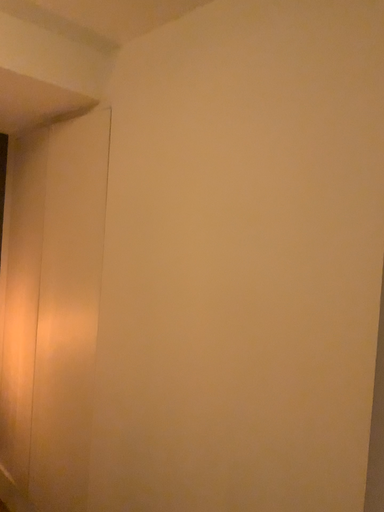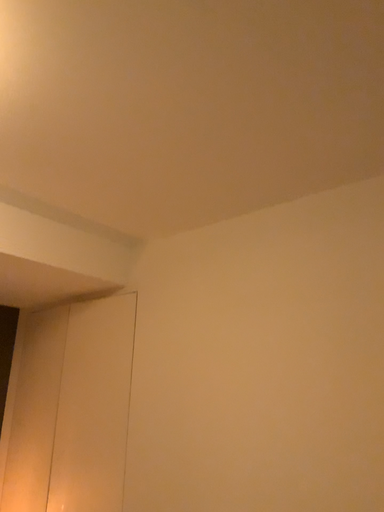
Question: How did the camera likely rotate when shooting the video?

Choices:
 (A) rotated downward
 (B) rotated upward

Answer: (B)